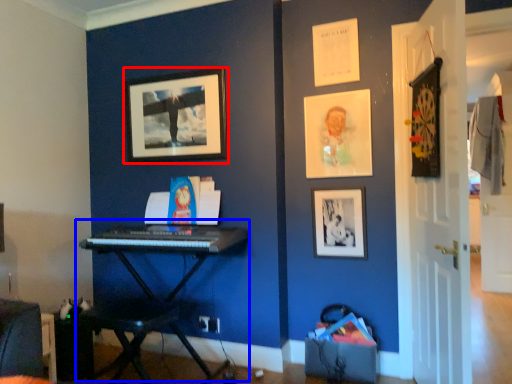
Question: Which object appears farthest to the camera in this image, picture frame (highlighted by a red box) or piano (highlighted by a blue box)?

Choices:
 (A) picture frame
 (B) piano

Answer: (A)